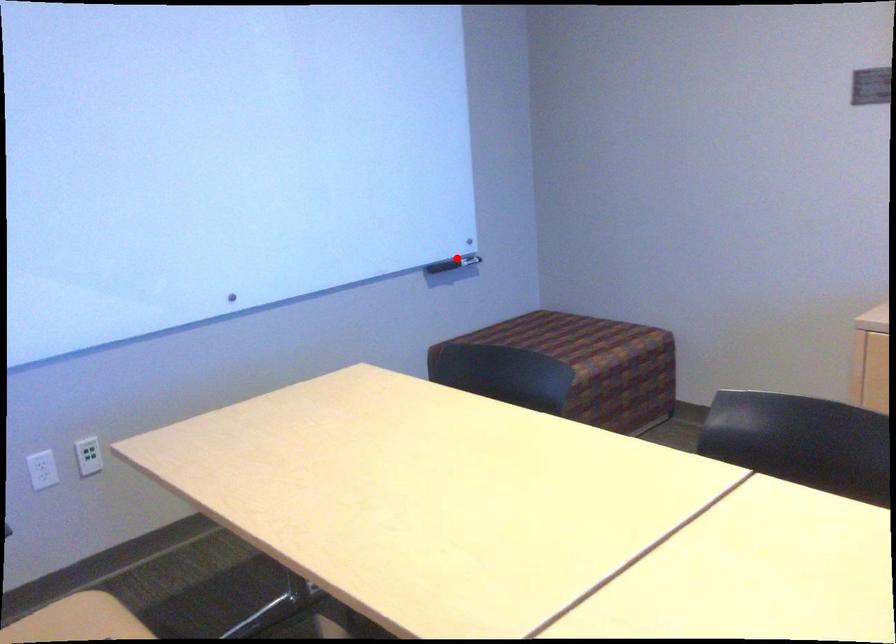
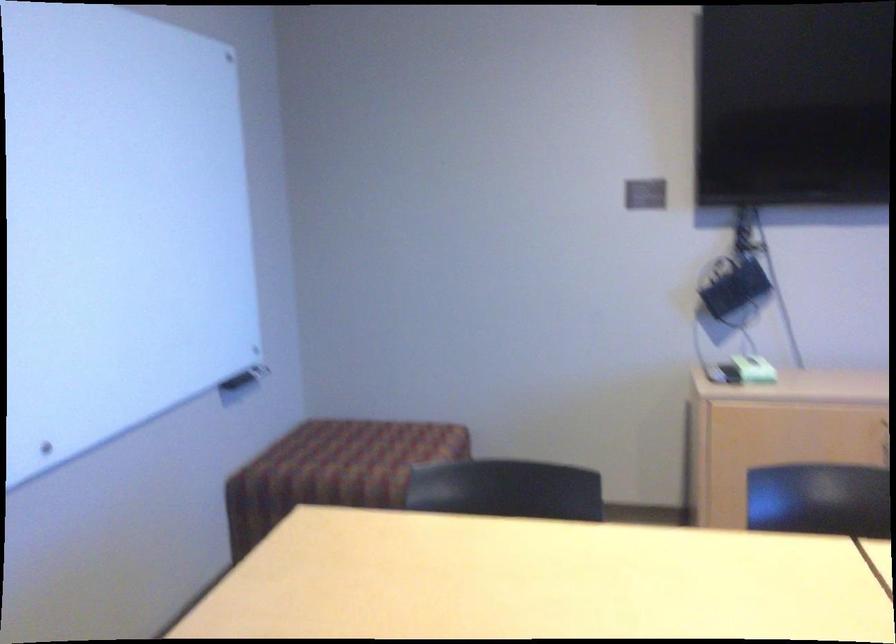
Where in the second image is the point corresponding to the highlighted location from the first image?

(246, 373)